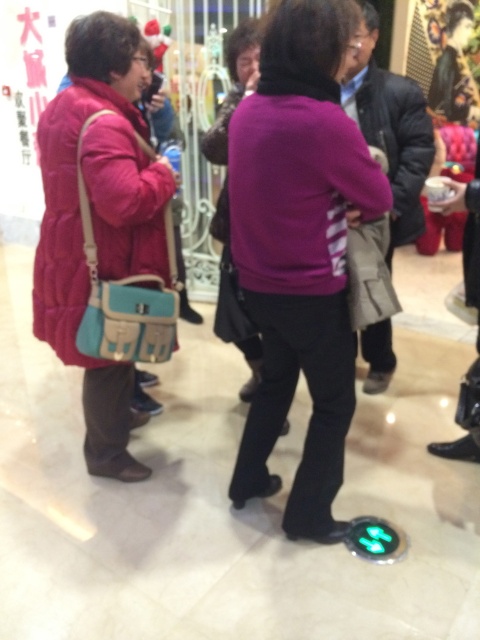
Question: Is purple matte sweater at center closer to camera compared to quilted red coat at left?

Choices:
 (A) yes
 (B) no

Answer: (A)

Question: Which point is closer to the camera?

Choices:
 (A) quilted red coat at left
 (B) purple matte sweater at center

Answer: (B)

Question: Does purple matte sweater at center have a greater width compared to quilted red coat at left?

Choices:
 (A) yes
 (B) no

Answer: (B)

Question: Is purple matte sweater at center positioned before quilted red coat at left?

Choices:
 (A) yes
 (B) no

Answer: (A)

Question: Which of the following is the farthest from the observer?

Choices:
 (A) quilted red coat at left
 (B) purple matte sweater at center

Answer: (A)